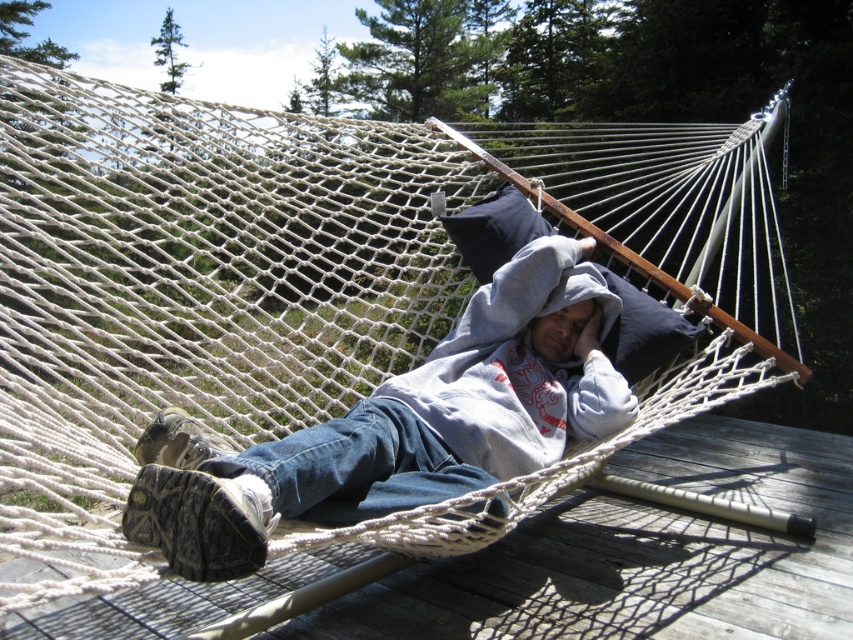
You are standing in front of the hammock and want to place a small plant between the two points marked as point (680, 515) and point (212, 518). Which point should the plant be closer to in order to be in front of the hammock?

The plant should be placed closer to point (680, 515) because it is further to the camera than point (212, 518), making it closer to the front of the hammock.

Based on the photo, you are standing at the edge of the wooden deck at center. You want to place a small potted plant exactly at point (641, 554). Is this possible?

The point (641, 554) is where the wooden deck at center is located, so yes, you can place the potted plant there.